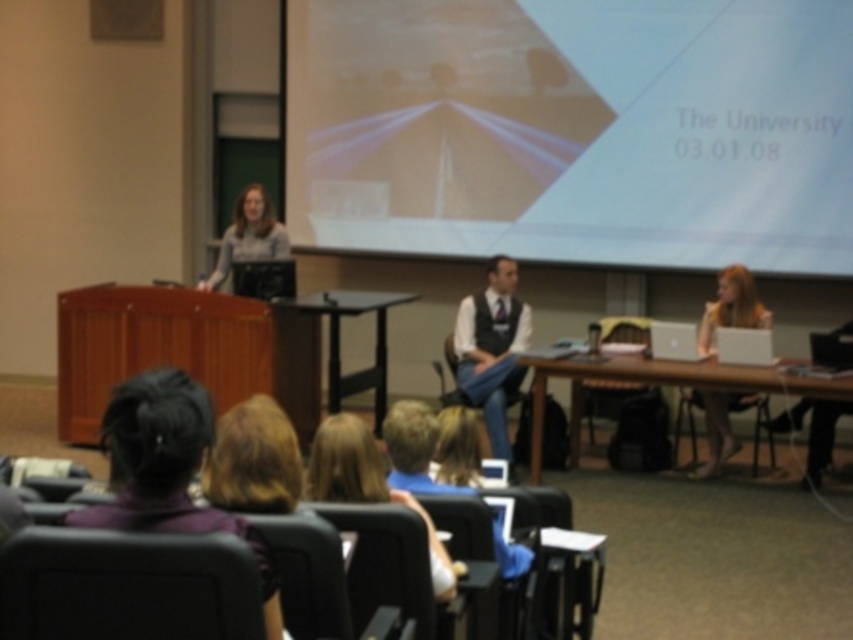
Which is in front, point (102, 432) or point (695, 355)?

Positioned in front is point (695, 355).

Does dark brown hair at lower left have a smaller size compared to silver metallic laptop at center?

Incorrect, dark brown hair at lower left is not smaller in size than silver metallic laptop at center.

Is point (128, 403) positioned after point (689, 333)?

That is False.

This screenshot has height=640, width=853. Identify the location of dark brown hair at lower left. (167, 470).

Between black leather chair at lower left and dark brown hair at lower left, which one is positioned lower?

black leather chair at lower left is below.

Does black leather chair at lower left appear on the left side of dark brown hair at lower left?

Correct, you'll find black leather chair at lower left to the left of dark brown hair at lower left.

Between point (128, 547) and point (144, 388), which one is positioned in front?

Positioned in front is point (128, 547).

Find the location of a particular element. Image resolution: width=853 pixels, height=640 pixels. black leather chair at lower left is located at coordinates (126, 586).

Does black leather chair at lower left have a lesser width compared to white shirt with vest at center?

Yes.

I want to click on black leather chair at lower left, so click(x=126, y=586).

I want to click on black leather chair at lower left, so click(x=126, y=586).